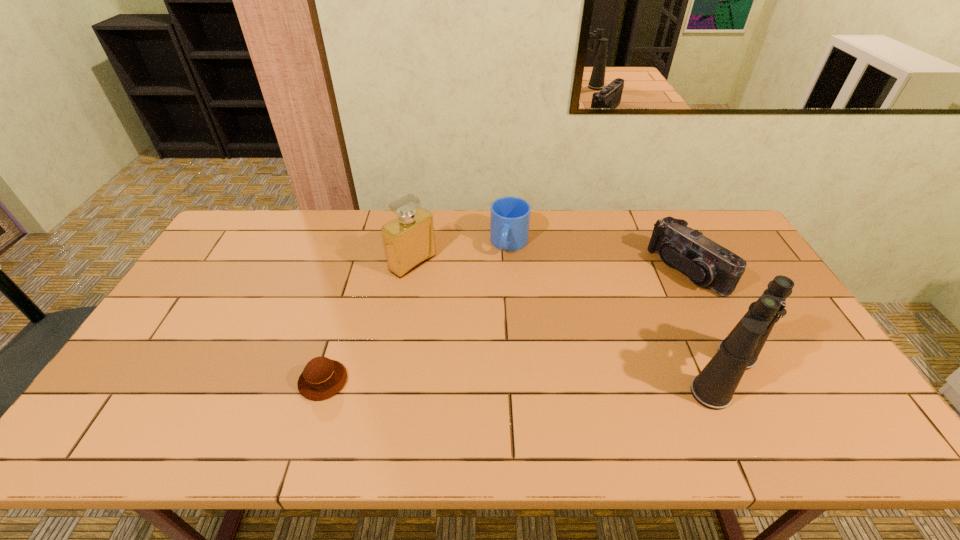
Where is `the shortest object`? This screenshot has width=960, height=540. the shortest object is located at coordinates (322, 378).

Where is `the leftmost object`? The image size is (960, 540). the leftmost object is located at coordinates (322, 378).

Where is `the tallest object`? The height and width of the screenshot is (540, 960). the tallest object is located at coordinates (713, 388).

Where is `the fourth object from right to left`? the fourth object from right to left is located at coordinates (409, 241).

What are the coordinates of `the second tallest object` in the screenshot? It's located at (409, 241).

This screenshot has height=540, width=960. What are the coordinates of `camcorder` in the screenshot? It's located at (706, 263).

I want to click on the third object from left to right, so click(509, 216).

Find the location of a particular element. vacant space situated on the right of the muffin is located at coordinates (502, 381).

Locate an element on the screen. free space located on the back of the tallest object is located at coordinates (695, 315).

This screenshot has height=540, width=960. What are the coordinates of `blank area located on the front-facing side of the perfume` in the screenshot? It's located at (514, 332).